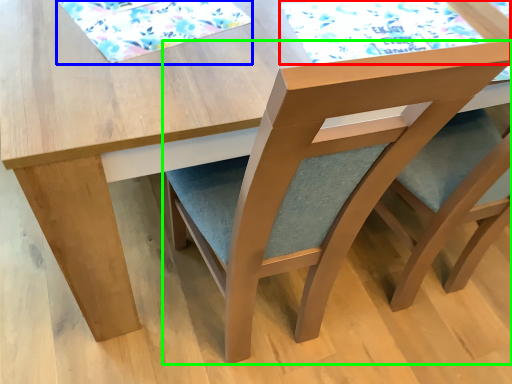
Question: Based on their relative distances, which object is nearer to mat (highlighted by a red box)? Choose from mat (highlighted by a blue box) and chair (highlighted by a green box).

Choices:
 (A) mat
 (B) chair

Answer: (A)